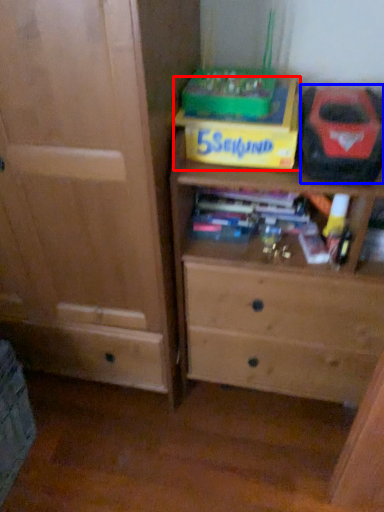
Question: Which of the following is the farthest to the observer, cardboard box (highlighted by a red box) or kit (highlighted by a blue box)?

Choices:
 (A) cardboard box
 (B) kit

Answer: (A)